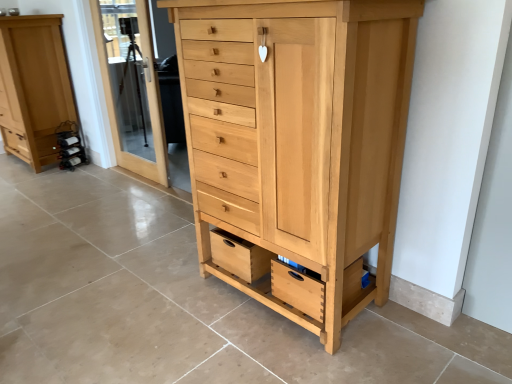
This screenshot has height=384, width=512. I want to click on natural wood drawer at lower center, so click(239, 256).

From the image's perspective, is natural wood cabinet at left, the 1th chest of drawers viewed from the left, above natural wood chest of drawers at center, the second chest of drawers from the left?

Correct, natural wood cabinet at left, the 1th chest of drawers viewed from the left, appears higher than natural wood chest of drawers at center, the second chest of drawers from the left, in the image.

Is natural wood cabinet at left, the second chest of drawers from the right, positioned far away from natural wood chest of drawers at center, marked as the first chest of drawers in a right-to-left arrangement?

Yes, natural wood cabinet at left, the second chest of drawers from the right, and natural wood chest of drawers at center, marked as the first chest of drawers in a right-to-left arrangement, are located far from each other.

Consider the image. Who is taller, natural wood cabinet at left, which is counted as the 1th chest of drawers, starting from the back, or natural wood chest of drawers at center, marked as the first chest of drawers in a right-to-left arrangement?

With more height is natural wood chest of drawers at center, marked as the first chest of drawers in a right-to-left arrangement.

Where is `screen door in front of the natural wood cabinet at left, the second chest of drawers from the right`? The width and height of the screenshot is (512, 384). screen door in front of the natural wood cabinet at left, the second chest of drawers from the right is located at coordinates (131, 86).

Relative to transparent glass door at upper left, is natural wood cabinet at left, which is counted as the 1th chest of drawers, starting from the back, in front or behind?

In the image, natural wood cabinet at left, which is counted as the 1th chest of drawers, starting from the back, appears behind transparent glass door at upper left.

Which is behind, point (42, 151) or point (106, 16)?

Point (106, 16)

In terms of height, does natural wood cabinet at left, the 1th chest of drawers viewed from the left, look taller or shorter compared to transparent glass door at upper left?

In the image, natural wood cabinet at left, the 1th chest of drawers viewed from the left, appears to be shorter than transparent glass door at upper left.

From a real-world perspective, which is physically above, transparent glass door at upper left or natural wood chest of drawers at center, marked as the first chest of drawers in a right-to-left arrangement?

From a 3D spatial view, transparent glass door at upper left is above.

From the image's perspective, does transparent glass door at upper left appear lower than natural wood chest of drawers at center, which is the first chest of drawers in front-to-back order?

No, from the image's perspective, transparent glass door at upper left is not beneath natural wood chest of drawers at center, which is the first chest of drawers in front-to-back order.

In order to click on screen door behind the natural wood chest of drawers at center, the second chest of drawers from the left in this screenshot , I will do `click(131, 86)`.

Which is nearer, [139,147] or [315,298]?

Point [315,298]

Looking at their sizes, would you say natural wood drawer at lower center is wider or thinner than natural wood chest of drawers at center, acting as the second chest of drawers starting from the back?

Considering their sizes, natural wood drawer at lower center looks slimmer than natural wood chest of drawers at center, acting as the second chest of drawers starting from the back.

From a real-world perspective, starting from the natural wood drawer at lower center, which chest of drawers is the 2nd one vertically above it? Please provide its 2D coordinates.

[(298, 140)]

Which object is further away from the camera, natural wood drawer at lower center or natural wood chest of drawers at center, acting as the second chest of drawers starting from the back?

natural wood drawer at lower center is further away from the camera.

Is natural wood drawer at lower center at the left side of natural wood chest of drawers at center, the second chest of drawers from the left?

Yes.

Which object is further away from the camera, transparent glass door at upper left or natural wood drawer at lower center?

transparent glass door at upper left is further from the camera.

From a real-world perspective, is transparent glass door at upper left below natural wood drawer at lower center?

Actually, transparent glass door at upper left is physically above natural wood drawer at lower center in the real world.

Is transparent glass door at upper left surrounding natural wood drawer at lower center?

No, transparent glass door at upper left does not contain natural wood drawer at lower center.

Can you confirm if transparent glass door at upper left is positioned to the left of natural wood drawer at lower center?

Yes, transparent glass door at upper left is to the left of natural wood drawer at lower center.

Looking at this image, can you confirm if natural wood drawer at lower center is taller than transparent glass door at upper left?

No, natural wood drawer at lower center is not taller than transparent glass door at upper left.

Can we say natural wood drawer at lower center lies outside transparent glass door at upper left?

That's correct, natural wood drawer at lower center is outside of transparent glass door at upper left.

Consider the image. In terms of size, does natural wood drawer at lower center appear bigger or smaller than transparent glass door at upper left?

Clearly, natural wood drawer at lower center is smaller in size than transparent glass door at upper left.

Considering the positions of objects natural wood drawer at lower center and transparent glass door at upper left in the image provided, who is in front, natural wood drawer at lower center or transparent glass door at upper left?

natural wood drawer at lower center is in front.

From the image's perspective, is natural wood cabinet at left, the 1th chest of drawers viewed from the left, on natural wood drawer at lower center?

Yes, from the image's perspective, natural wood cabinet at left, the 1th chest of drawers viewed from the left, is over natural wood drawer at lower center.

Based on the photo, what's the angular difference between natural wood cabinet at left, which is counted as the 1th chest of drawers, starting from the back, and natural wood drawer at lower center's facing directions?

The angular difference between natural wood cabinet at left, which is counted as the 1th chest of drawers, starting from the back, and natural wood drawer at lower center is 0.899 degrees.

Is point (21, 142) farther from viewer compared to point (224, 253)?

That is True.

Where is `chest of drawers to the right of natural wood cabinet at left, which is counted as the 1th chest of drawers, starting from the back`? This screenshot has width=512, height=384. chest of drawers to the right of natural wood cabinet at left, which is counted as the 1th chest of drawers, starting from the back is located at coordinates (298, 140).

This screenshot has height=384, width=512. Find the location of `chest of drawers located on the left of transparent glass door at upper left`. chest of drawers located on the left of transparent glass door at upper left is located at coordinates (33, 87).

Estimate the real-world distances between objects in this image. Which object is closer to transparent glass door at upper left, natural wood cabinet at left, the 1th chest of drawers viewed from the left, or natural wood chest of drawers at center, acting as the second chest of drawers starting from the back?

natural wood cabinet at left, the 1th chest of drawers viewed from the left, is positioned closer to the anchor transparent glass door at upper left.

Considering their positions, is natural wood chest of drawers at center, the second chest of drawers from the left, positioned further to natural wood cabinet at left, the second chest of drawers from the right, than natural wood drawer at lower center?

natural wood chest of drawers at center, the second chest of drawers from the left, is further to natural wood cabinet at left, the second chest of drawers from the right.

Estimate the real-world distances between objects in this image. Which object is further from natural wood chest of drawers at center, which is the first chest of drawers in front-to-back order, natural wood cabinet at left, which is counted as the 1th chest of drawers, starting from the back, or natural wood drawer at lower center?

natural wood cabinet at left, which is counted as the 1th chest of drawers, starting from the back, lies further to natural wood chest of drawers at center, which is the first chest of drawers in front-to-back order, than the other object.

Looking at the image, which one is located closer to natural wood chest of drawers at center, which is the first chest of drawers in front-to-back order, natural wood drawer at lower center or transparent glass door at upper left?

→ Among the two, natural wood drawer at lower center is located nearer to natural wood chest of drawers at center, which is the first chest of drawers in front-to-back order.

Based on their spatial positions, is transparent glass door at upper left or natural wood drawer at lower center further from natural wood cabinet at left, which is counted as the 1th chest of drawers, starting from the back?

natural wood drawer at lower center is further to natural wood cabinet at left, which is counted as the 1th chest of drawers, starting from the back.

From the image, which object appears to be farther from natural wood drawer at lower center, natural wood cabinet at left, the 1th chest of drawers viewed from the left, or natural wood chest of drawers at center, which is the first chest of drawers in front-to-back order?

natural wood cabinet at left, the 1th chest of drawers viewed from the left, is positioned further to the anchor natural wood drawer at lower center.

Which object lies nearer to the anchor point natural wood drawer at lower center, natural wood chest of drawers at center, the second chest of drawers from the left, or transparent glass door at upper left?

The object closer to natural wood drawer at lower center is natural wood chest of drawers at center, the second chest of drawers from the left.

Looking at the image, which one is located further to transparent glass door at upper left, natural wood drawer at lower center or natural wood cabinet at left, the 1th chest of drawers viewed from the left?

Based on the image, natural wood drawer at lower center appears to be further to transparent glass door at upper left.

At what (x,y) coordinates should I click in order to perform the action: click on screen door between natural wood cabinet at left, which is counted as the 1th chest of drawers, starting from the back, and natural wood chest of drawers at center, the second chest of drawers from the left. Please return your answer as a coordinate pair (x, y). Image resolution: width=512 pixels, height=384 pixels. Looking at the image, I should click on (131, 86).

The width and height of the screenshot is (512, 384). I want to click on screen door between natural wood cabinet at left, positioned as the 2th chest of drawers in front-to-back order, and natural wood drawer at lower center, so click(x=131, y=86).

The image size is (512, 384). What are the coordinates of `drawer between natural wood cabinet at left, which is counted as the 1th chest of drawers, starting from the back, and natural wood chest of drawers at center, which is the first chest of drawers in front-to-back order` in the screenshot? It's located at (239, 256).

This screenshot has height=384, width=512. Identify the location of drawer between natural wood chest of drawers at center, which is the first chest of drawers in front-to-back order, and transparent glass door at upper left in the front-back direction. (239, 256).